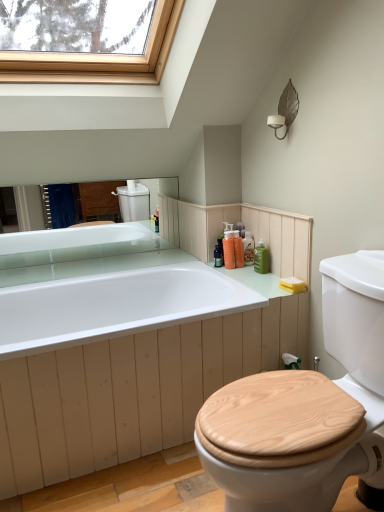
At what (x,y) coordinates should I click in order to perform the action: click on vacant space that's between yellow sponge at right and translucent plastic bottles at upper right, the first toiletry from the left. Please return your answer as a coordinate pair (x, y). The image size is (384, 512). Looking at the image, I should click on (266, 276).